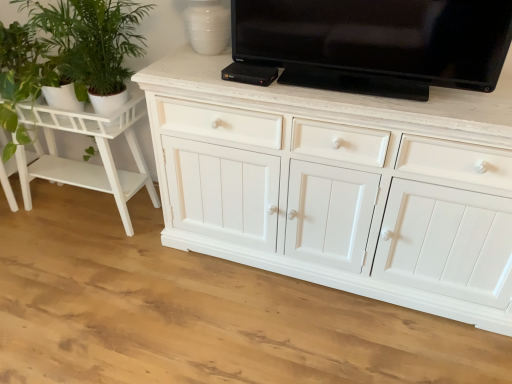
Question: Considering the relative positions of green leafy plant at left and white painted wood side table at left in the image provided, is green leafy plant at left behind white painted wood side table at left?

Choices:
 (A) no
 (B) yes

Answer: (A)

Question: From a real-world perspective, is green leafy plant at left below white painted wood side table at left?

Choices:
 (A) no
 (B) yes

Answer: (A)

Question: Considering the relative sizes of green leafy plant at left and white painted wood side table at left in the image provided, is green leafy plant at left bigger than white painted wood side table at left?

Choices:
 (A) yes
 (B) no

Answer: (B)

Question: Is white painted wood side table at left inside green leafy plant at left?

Choices:
 (A) yes
 (B) no

Answer: (B)

Question: Is the depth of green leafy plant at left less than that of white painted wood side table at left?

Choices:
 (A) yes
 (B) no

Answer: (A)

Question: Considering the positions of white painted wood side table at left and black glossy tv at upper center in the image, is white painted wood side table at left bigger or smaller than black glossy tv at upper center?

Choices:
 (A) small
 (B) big

Answer: (B)

Question: Looking at their shapes, would you say white painted wood side table at left is wider or thinner than black glossy tv at upper center?

Choices:
 (A) wide
 (B) thin

Answer: (A)

Question: Is white painted wood side table at left taller or shorter than black glossy tv at upper center?

Choices:
 (A) short
 (B) tall

Answer: (B)

Question: Considering the positions of point (44, 127) and point (424, 52), is point (44, 127) closer or farther from the camera than point (424, 52)?

Choices:
 (A) closer
 (B) farther

Answer: (B)

Question: Is black glossy tv at upper center in front of or behind white painted wood side table at left in the image?

Choices:
 (A) behind
 (B) front

Answer: (B)

Question: Would you say black glossy tv at upper center is inside or outside white painted wood side table at left?

Choices:
 (A) inside
 (B) outside

Answer: (B)

Question: From the image's perspective, is black glossy tv at upper center located above or below white painted wood side table at left?

Choices:
 (A) below
 (B) above

Answer: (B)

Question: Looking at the image, does black glossy tv at upper center seem bigger or smaller compared to white painted wood side table at left?

Choices:
 (A) big
 (B) small

Answer: (B)

Question: Considering the positions of point (80, 114) and point (93, 3), is point (80, 114) closer or farther from the camera than point (93, 3)?

Choices:
 (A) closer
 (B) farther

Answer: (B)

Question: Based on their sizes in the image, would you say white painted wood side table at left is bigger or smaller than green leafy plant at left?

Choices:
 (A) small
 (B) big

Answer: (B)